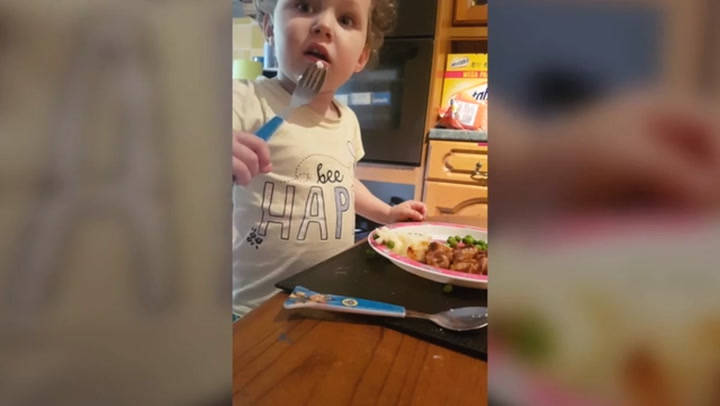
This screenshot has width=720, height=406. What are the coordinates of `wooden table` in the screenshot? It's located at (281, 334).